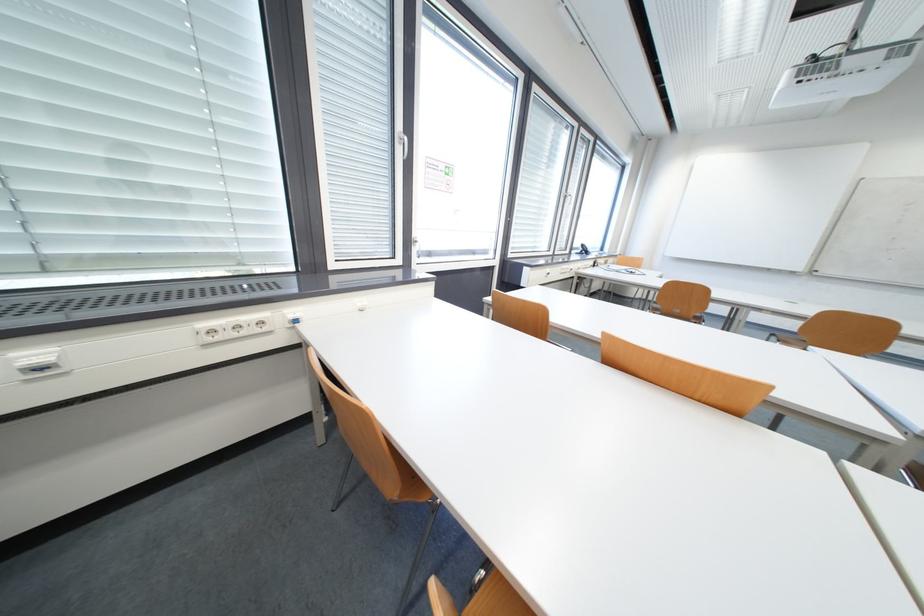
Locate an element on the screen. The height and width of the screenshot is (616, 924). black phone handset is located at coordinates (584, 249).